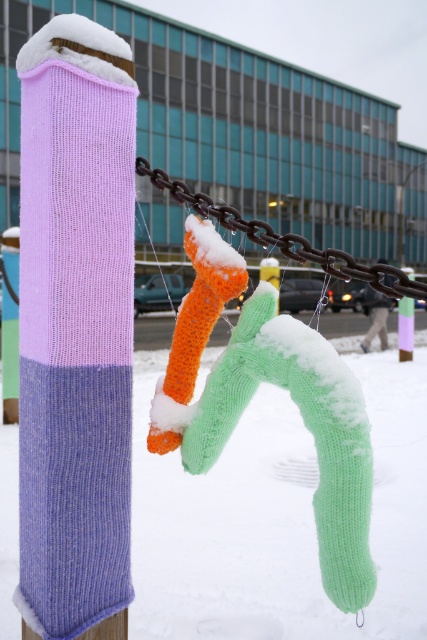
Is point (46, 609) closer to viewer compared to point (350, 499)?

No, (46, 609) is further to viewer.

This screenshot has height=640, width=427. What do you see at coordinates (76, 328) in the screenshot? I see `purple knitted sock at left` at bounding box center [76, 328].

Who is more distant from viewer, (98, 406) or (227, 362)?

Point (98, 406)

Find the location of a particular element. This screenshot has height=640, width=427. purple knitted sock at left is located at coordinates (76, 328).

Who is positioned more to the left, purple knitted sock at left or rusty metal chain at center?

From the viewer's perspective, purple knitted sock at left appears more on the left side.

Is purple knitted sock at left positioned in front of rusty metal chain at center?

No, purple knitted sock at left is further to the viewer.

Does point (61, 605) come in front of point (415, 289)?

No, it is behind (415, 289).

This screenshot has width=427, height=640. I want to click on purple knitted sock at left, so click(76, 328).

Can you confirm if purple knitted sock at left is positioned to the right of orange knitted sock at center?

No, purple knitted sock at left is not to the right of orange knitted sock at center.

Image resolution: width=427 pixels, height=640 pixels. Find the location of `purple knitted sock at left`. purple knitted sock at left is located at coordinates (76, 328).

Locate an element on the screen. purple knitted sock at left is located at coordinates [x=76, y=328].